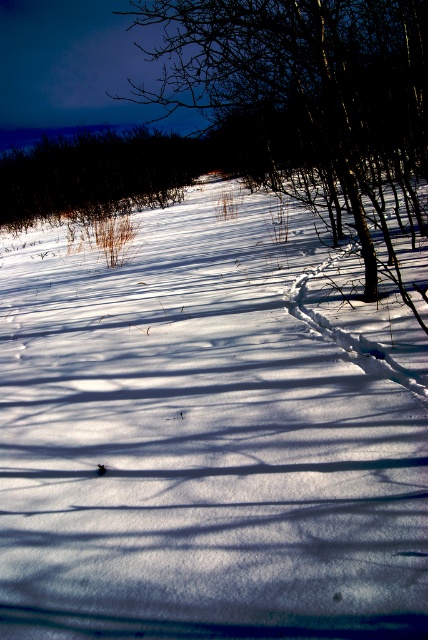
Who is more distant from viewer, (x=139, y=596) or (x=309, y=45)?

The point (x=309, y=45) is behind.

Between white snow at center and brown textured tree at center, which one is positioned higher?

brown textured tree at center is above.

Locate an element on the screen. Image resolution: width=428 pixels, height=640 pixels. white snow at center is located at coordinates (199, 444).

What do you see at coordinates (303, 74) in the screenshot? The height and width of the screenshot is (640, 428). I see `brown textured tree at center` at bounding box center [303, 74].

Who is lower down, brown textured tree at center or dark brown shrub at upper left?

brown textured tree at center is lower down.

Is point (410, 132) farther from viewer compared to point (109, 189)?

No, it is in front of (109, 189).

At what (x,y) coordinates should I click in order to perform the action: click on brown textured tree at center. Please return your answer as a coordinate pair (x, y). This screenshot has height=640, width=428. Looking at the image, I should click on (303, 74).

Who is more distant from viewer, (x=118, y=388) or (x=44, y=212)?

The point (x=44, y=212) is more distant.

What are the coordinates of `white snow at center` in the screenshot? It's located at (199, 444).